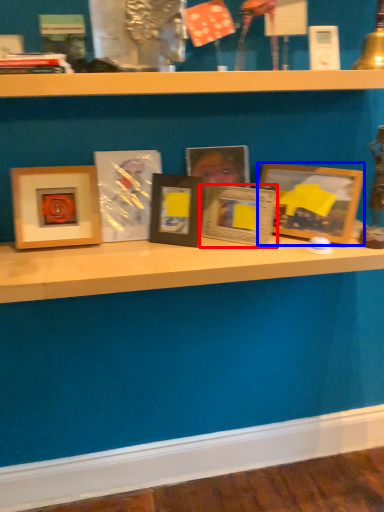
Question: Which object is further to the camera taking this photo, picture frame (highlighted by a red box) or picture frame (highlighted by a blue box)?

Choices:
 (A) picture frame
 (B) picture frame

Answer: (A)